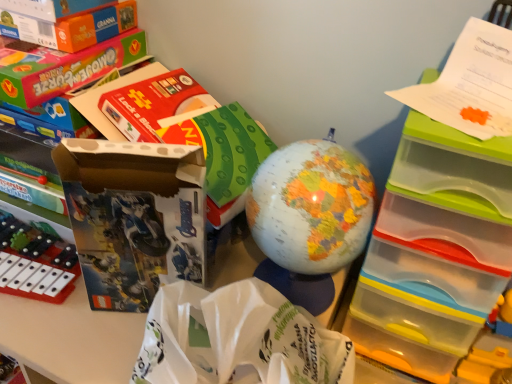
Question: Which direction should I rotate to face matte plastic globe at center, which is the 2th toy from left to right, — up or down?

Choices:
 (A) down
 (B) up

Answer: (A)

Question: Can we say yellow plastic toy at lower right, the first toy from the right, lies outside white paper bag at center?

Choices:
 (A) yes
 (B) no

Answer: (A)

Question: Can you confirm if yellow plastic toy at lower right, which is counted as the third toy, starting from the left, is taller than white paper bag at center?

Choices:
 (A) no
 (B) yes

Answer: (A)

Question: Is yellow plastic toy at lower right, the first toy from the right, to the left of white paper bag at center from the viewer's perspective?

Choices:
 (A) no
 (B) yes

Answer: (A)

Question: From the image's perspective, is yellow plastic toy at lower right, which is counted as the third toy, starting from the left, beneath white paper bag at center?

Choices:
 (A) no
 (B) yes

Answer: (B)

Question: Is yellow plastic toy at lower right, the first toy from the right, positioned with its back to white paper bag at center?

Choices:
 (A) no
 (B) yes

Answer: (A)

Question: Is white paper bag at center inside yellow plastic toy at lower right, the first toy from the right?

Choices:
 (A) no
 (B) yes

Answer: (A)

Question: Is white paper bag at center closer to camera compared to matte cardboard box at left?

Choices:
 (A) yes
 (B) no

Answer: (A)

Question: From a real-world perspective, is white paper bag at center located beneath matte cardboard box at left?

Choices:
 (A) yes
 (B) no

Answer: (A)

Question: Is white paper bag at center positioned far away from matte cardboard box at left?

Choices:
 (A) yes
 (B) no

Answer: (B)

Question: Considering the relative positions of white paper bag at center and matte cardboard box at left in the image provided, is white paper bag at center to the right of matte cardboard box at left from the viewer's perspective?

Choices:
 (A) no
 (B) yes

Answer: (B)

Question: From the image's perspective, is white paper bag at center beneath matte cardboard box at left?

Choices:
 (A) yes
 (B) no

Answer: (A)

Question: Is white paper bag at center to the left of matte cardboard box at left from the viewer's perspective?

Choices:
 (A) yes
 (B) no

Answer: (B)

Question: Is matte cardboard box at left further to the viewer compared to yellow plastic toy at lower right, the first toy from the right?

Choices:
 (A) yes
 (B) no

Answer: (B)